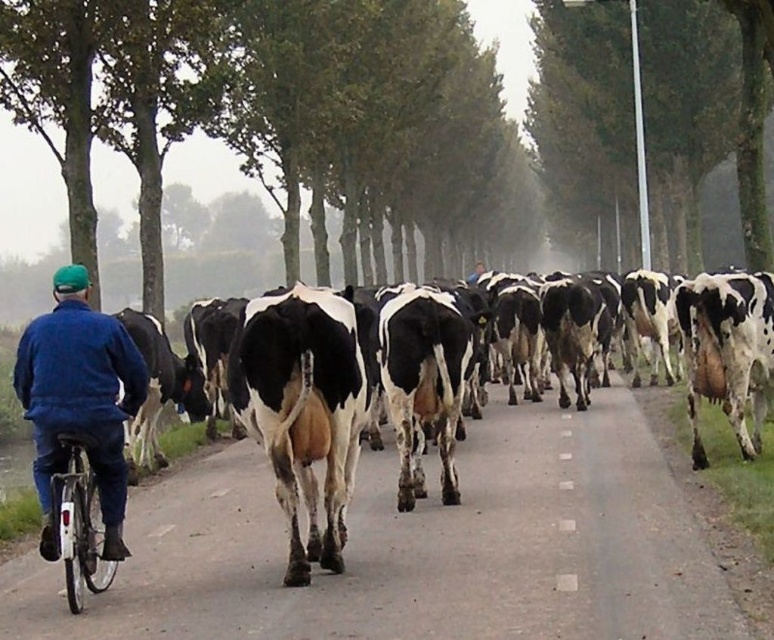
Question: Which point appears closest to the camera in this image?

Choices:
 (A) (81, 452)
 (B) (117, 342)

Answer: (A)

Question: Is blue fleece jacket at left wider than silver metallic bicycle at lower left?

Choices:
 (A) no
 (B) yes

Answer: (B)

Question: Is blue fleece jacket at left positioned in front of silver metallic bicycle at lower left?

Choices:
 (A) no
 (B) yes

Answer: (B)

Question: Is blue fleece jacket at left above silver metallic bicycle at lower left?

Choices:
 (A) no
 (B) yes

Answer: (B)